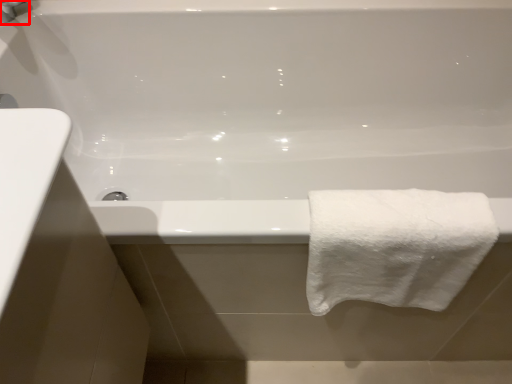
Question: Where is faucet (annotated by the red box) located in relation to towel in the image?

Choices:
 (A) right
 (B) left

Answer: (B)